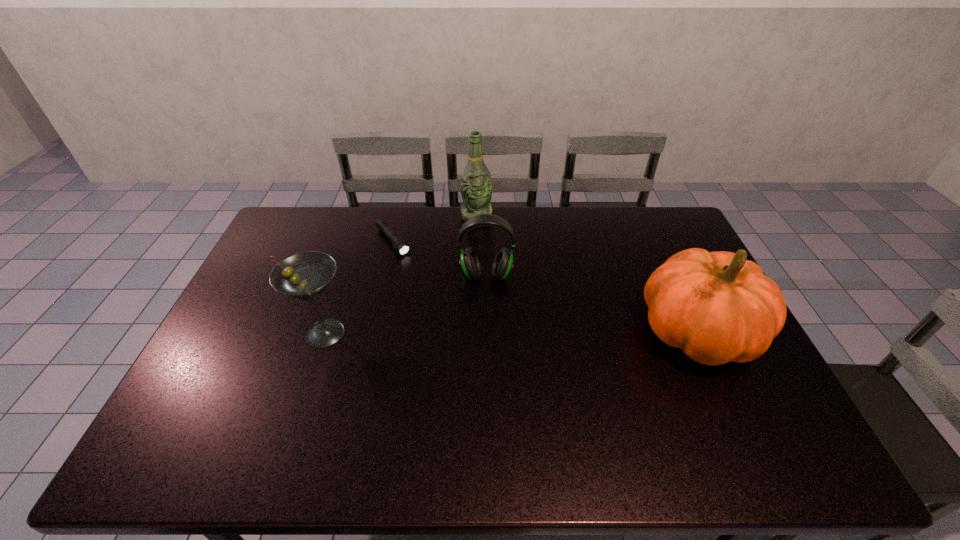
Image resolution: width=960 pixels, height=540 pixels. I want to click on free area in between the pumpkin and the second shortest object, so [591, 305].

Find the location of `vacant region between the martini and the beer bottle`. vacant region between the martini and the beer bottle is located at coordinates (400, 275).

Find the location of a particular element. free spot between the flashlight and the martini is located at coordinates (359, 287).

Locate an element on the screen. This screenshot has height=540, width=960. free space that is in between the beer bottle and the headset is located at coordinates (481, 246).

Identify the location of free spot between the pumpkin and the headset. (591, 305).

Identify which object is the second closest to the pumpkin. Please provide its 2D coordinates. Your answer should be formatted as a tuple, i.e. [(x, y)], where the tuple contains the x and y coordinates of a point satisfying the conditions above.

[(476, 187)]

This screenshot has height=540, width=960. I want to click on object that is the third closest to the fourth tallest object, so click(x=306, y=275).

Find the location of `free spot that satisfies the following two spatial constraints: 1. on the back side of the martini; 2. on the right side of the beer bottle`. free spot that satisfies the following two spatial constraints: 1. on the back side of the martini; 2. on the right side of the beer bottle is located at coordinates (364, 217).

This screenshot has height=540, width=960. Identify the location of vacant area that satisfies the following two spatial constraints: 1. on the front side of the beer bottle; 2. on the left side of the rightmost object. (475, 334).